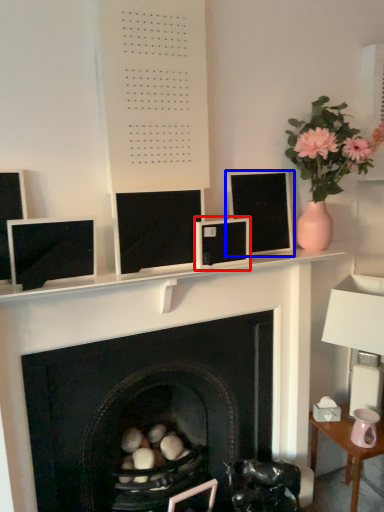
Question: Among these objects, which one is farthest to the camera, computer monitor (highlighted by a red box) or computer monitor (highlighted by a blue box)?

Choices:
 (A) computer monitor
 (B) computer monitor

Answer: (B)